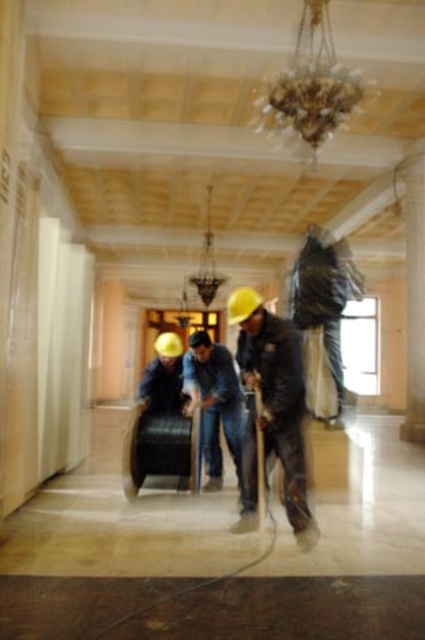
Between point (275, 381) and point (209, 422), which one is positioned in front?

Positioned in front is point (275, 381).

Can you confirm if matte black jacket at center is positioned above blue jeans at center?

Correct, matte black jacket at center is located above blue jeans at center.

Does point (297, 508) lie behind point (198, 384)?

No, it is in front of (198, 384).

Find the location of a particular element. This screenshot has height=640, width=425. matte black jacket at center is located at coordinates (272, 410).

Where is `gold metallic chandelier at upper center`? gold metallic chandelier at upper center is located at coordinates (312, 83).

Does point (314, 42) come farther from viewer compared to point (207, 396)?

No, (314, 42) is closer to viewer.

You are a GUI agent. You are given a task and a screenshot of the screen. Output one action in this format:
    pyautogui.click(x=<x>, y=<y>)
    Task: Click on the gold metallic chandelier at upper center
    
    Given the screenshot: What is the action you would take?
    pyautogui.click(x=312, y=83)

Measure the distance from matte black jacket at center to gold metallic chandelier at upper center.

matte black jacket at center and gold metallic chandelier at upper center are 2.38 meters apart.

Does point (286, 364) lie behind point (326, 90)?

No, it is in front of (326, 90).

Looking at this image, who is more forward, (x=285, y=336) or (x=345, y=90)?

Point (x=285, y=336) is in front.

The image size is (425, 640). What are the coordinates of `matte black jacket at center` in the screenshot? It's located at click(x=272, y=410).